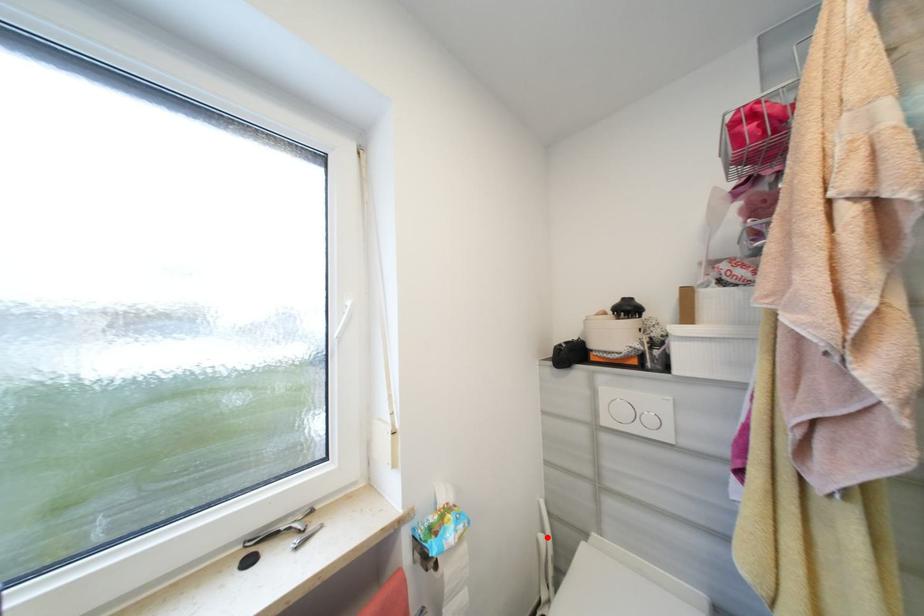
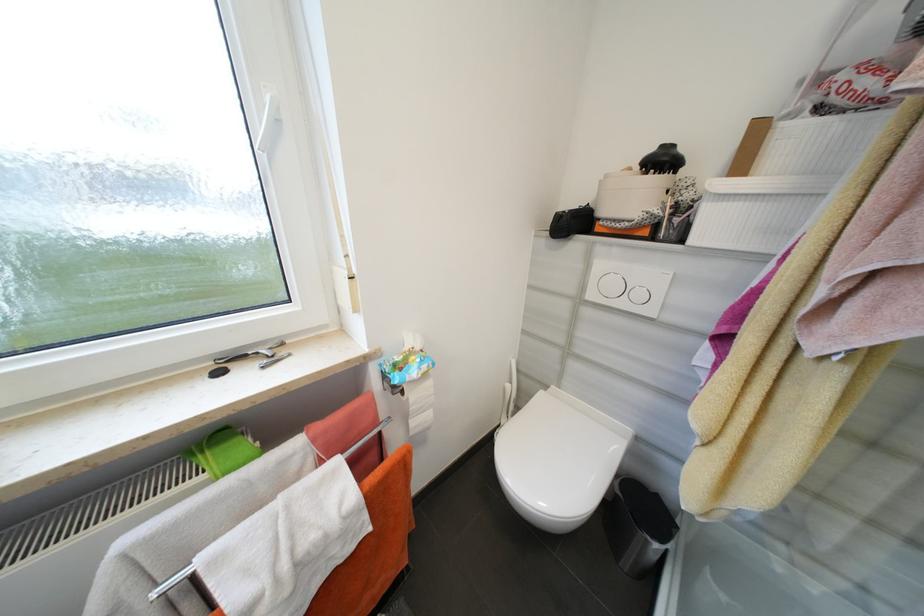
In the second image, find the point that corresponds to the highlighted location in the first image.

(514, 387)